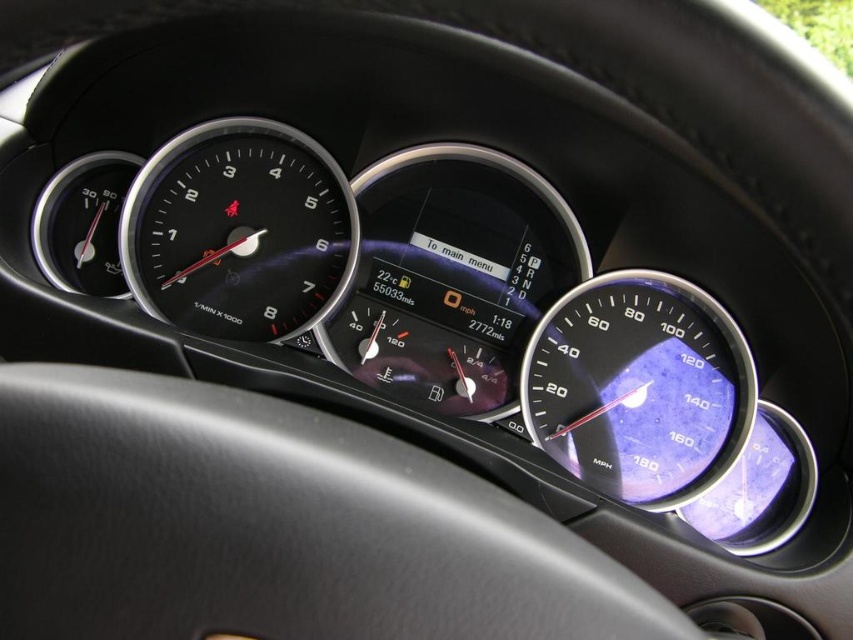
Between point (595, 586) and point (189, 218), which one is positioned in front?

Point (595, 586) is more forward.

Is point (79, 609) behind point (256, 280)?

No, (79, 609) is closer to viewer.

At what (x,y) coordinates should I click in order to perform the action: click on black leather steering wheel at center. Please return your answer as a coordinate pair (x, y). The height and width of the screenshot is (640, 853). Looking at the image, I should click on (271, 525).

Is black leather steering wheel at center positioned before transparent plastic speedometer at right?

Yes, it is.

Looking at this image, who is higher up, black leather steering wheel at center or transparent plastic speedometer at right?

black leather steering wheel at center is higher up.

Between point (334, 502) and point (735, 358), which one is positioned in front?

Positioned in front is point (334, 502).

At what (x,y) coordinates should I click in order to perform the action: click on black leather steering wheel at center. Please return your answer as a coordinate pair (x, y). Looking at the image, I should click on (271, 525).

Is transparent plastic speedometer at right to the right of black glass speedometer at center from the viewer's perspective?

Indeed, transparent plastic speedometer at right is positioned on the right side of black glass speedometer at center.

Locate an element on the screen. The height and width of the screenshot is (640, 853). transparent plastic speedometer at right is located at coordinates tap(639, 387).

The height and width of the screenshot is (640, 853). What are the coordinates of `transparent plastic speedometer at right` in the screenshot? It's located at (639, 387).